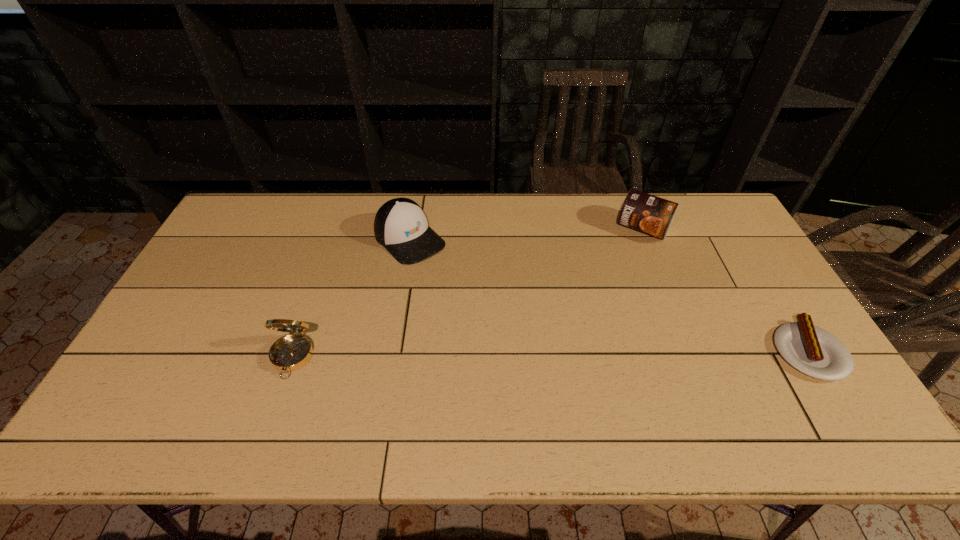
The width and height of the screenshot is (960, 540). What are the coordinates of `free spot on the desktop that is between the compass and the sausage and is positioned on the front label of the third object from left to right` in the screenshot? It's located at (568, 354).

Identify the location of free spot on the desktop that is between the leftmost object and the rightmost object and is positioned on the front panel of the third object from right to left. Image resolution: width=960 pixels, height=540 pixels. (533, 354).